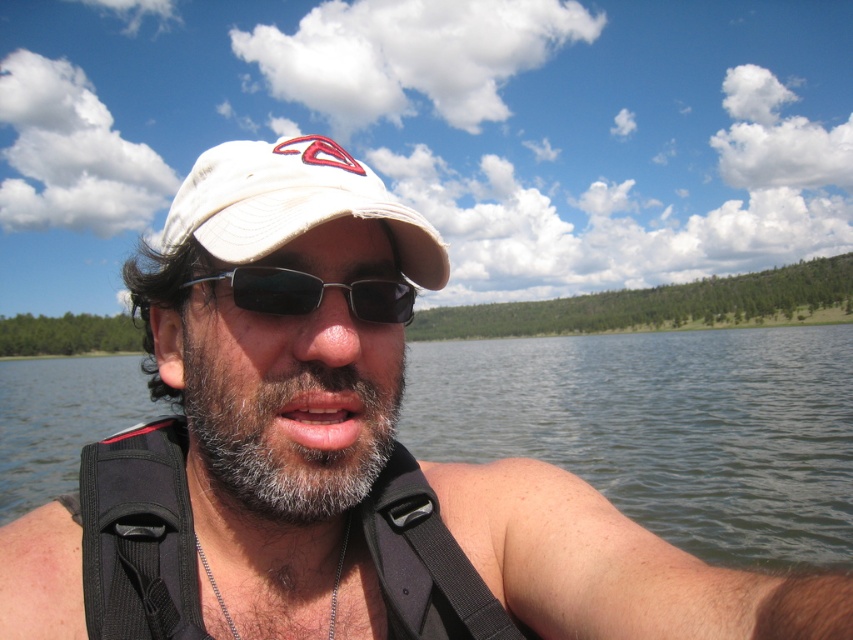
Question: Is clear water at center to the left of black fabric strap at lower center from the viewer's perspective?

Choices:
 (A) no
 (B) yes

Answer: (B)

Question: Among these objects, which one is nearest to the camera?

Choices:
 (A) white fabric cap at center
 (B) black plastic sunglasses at center
 (C) gray matte beard at center
 (D) black fabric strap at lower center

Answer: (B)

Question: Is clear water at center wider than black plastic sunglasses at center?

Choices:
 (A) no
 (B) yes

Answer: (B)

Question: Which of the following is the farthest from the observer?

Choices:
 (A) white fabric cap at center
 (B) gray matte beard at center
 (C) clear water at center
 (D) black fabric strap at lower center

Answer: (C)

Question: Does gray matte beard at center appear over black fabric strap at lower center?

Choices:
 (A) no
 (B) yes

Answer: (B)

Question: Which point is farther to the camera?

Choices:
 (A) black plastic sunglasses at center
 (B) white fabric cap at center
 (C) black fabric strap at lower center

Answer: (C)